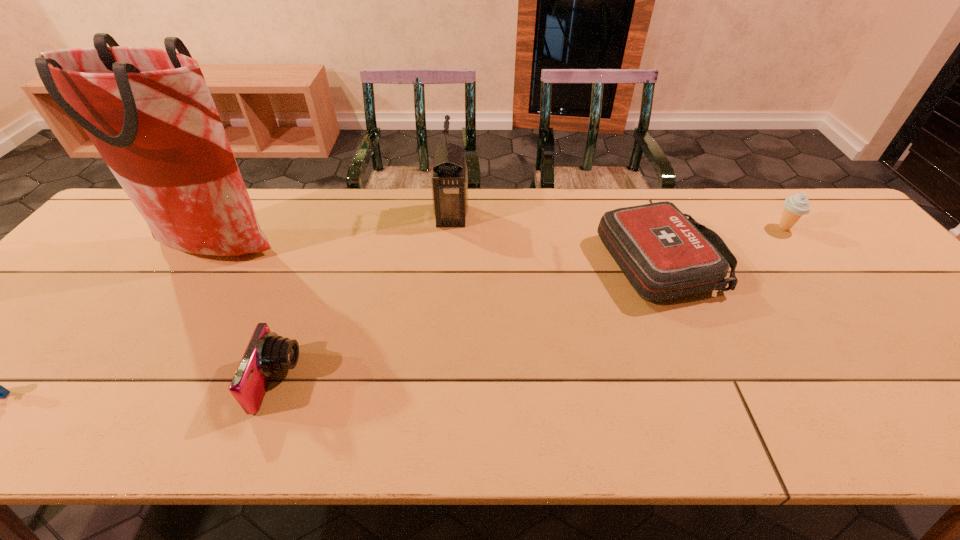
I want to click on free space located on the left of the fifth object from left to right, so click(x=538, y=263).

Identify the location of vacant space located 0.190m on the front-facing side of the camera. The image size is (960, 540). (387, 381).

What are the coordinates of `grocery bag at the far edge` in the screenshot? It's located at (149, 113).

The height and width of the screenshot is (540, 960). In order to click on lantern that is at the far edge in this screenshot , I will do `click(449, 182)`.

Where is `icecream present at the far edge`? This screenshot has width=960, height=540. icecream present at the far edge is located at coordinates pos(796,205).

This screenshot has width=960, height=540. Identify the location of the first-aid kit that is at the far edge. (663, 254).

Locate an element on the screen. object present at the near edge is located at coordinates (267, 353).

I want to click on object at the right edge, so click(x=796, y=205).

In order to click on object that is positioned at the far right corner in this screenshot , I will do `click(796, 205)`.

At what (x,y) coordinates should I click in order to perform the action: click on vacant area at the far edge. Please return your answer as a coordinate pair (x, y). Image resolution: width=960 pixels, height=540 pixels. Looking at the image, I should click on (377, 227).